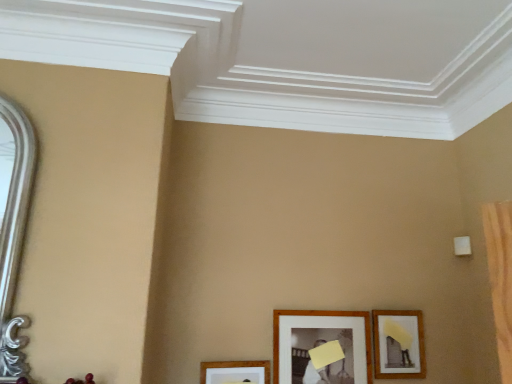
Question: Choose the correct answer: Is wooden picture frame at lower center, placed as the 2th picture frame when sorted from left to right, inside wooden framed picture at lower right, the third picture frame when ordered from left to right, or outside it?

Choices:
 (A) inside
 (B) outside

Answer: (B)

Question: Is wooden picture frame at lower center, which is counted as the second picture frame, starting from the right, bigger or smaller than wooden framed picture at lower right, the third picture frame when ordered from left to right?

Choices:
 (A) big
 (B) small

Answer: (A)

Question: Which object is the closest to the wooden framed picture at lower right, placed as the first picture frame when sorted from right to left?

Choices:
 (A) wooden picture frame at lower center, which is counted as the second picture frame, starting from the right
 (B) wooden picture frame at lower center, the 3th picture frame viewed from the right

Answer: (A)

Question: Considering the real-world distances, which object is closest to the wooden picture frame at lower center, which is counted as the second picture frame, starting from the right?

Choices:
 (A) wooden picture frame at lower center, the first picture frame positioned from the left
 (B) wooden framed picture at lower right, the third picture frame when ordered from left to right

Answer: (B)